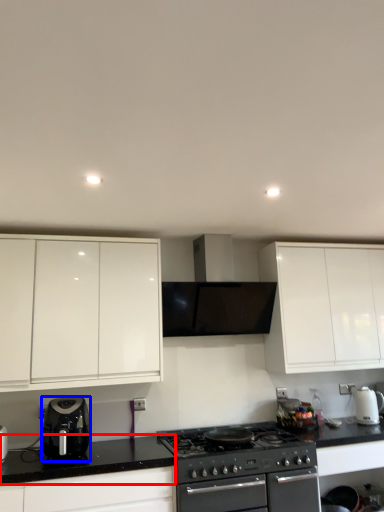
Question: Which point is further to the camera, counter top (highlighted by a red box) or kitchen appliance (highlighted by a blue box)?

Choices:
 (A) counter top
 (B) kitchen appliance

Answer: (B)